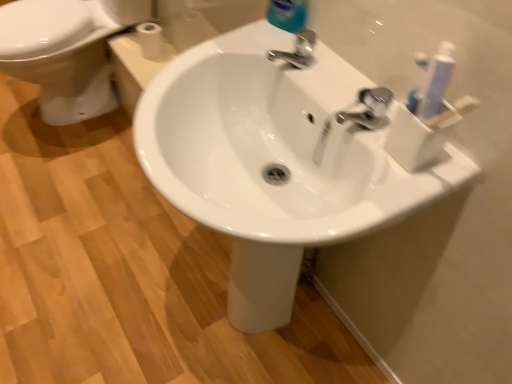
You are a GUI agent. You are given a task and a screenshot of the screen. Output one action in this format:
    pyautogui.click(x=<x>, y=<y>)
    Task: Click on the unoccupied space behind silver metallic faucet at upper center, the 2th tap in the right-to-left sequence
    This screenshot has width=512, height=384.
    Given the screenshot: What is the action you would take?
    pyautogui.click(x=285, y=29)